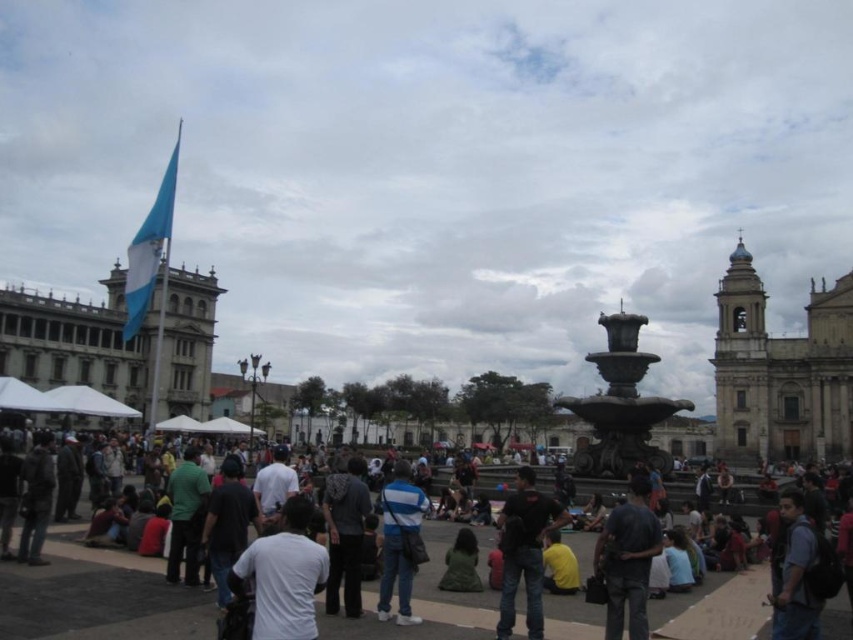
Looking at this image, between bronze ornate fountain at center and dark blue shirt at center, which one has more height?

bronze ornate fountain at center

Is bronze ornate fountain at center below dark blue shirt at center?

No.

Does point (596, 412) come closer to viewer compared to point (643, 637)?

No, it is not.

You are a GUI agent. You are given a task and a screenshot of the screen. Output one action in this format:
    pyautogui.click(x=<x>, y=<y>)
    Task: Click on the bronze ornate fountain at center
    
    Given the screenshot: What is the action you would take?
    pyautogui.click(x=619, y=404)

Is point (514, 596) closer to camera compared to point (390, 547)?

That is True.

Is black matte shirt at center to the left of striped cotton shirt at center from the viewer's perspective?

In fact, black matte shirt at center is to the right of striped cotton shirt at center.

The width and height of the screenshot is (853, 640). Describe the element at coordinates (524, 550) in the screenshot. I see `black matte shirt at center` at that location.

The image size is (853, 640). I want to click on black matte shirt at center, so [x=524, y=550].

Who is more forward, (399, 531) or (813, 561)?

Point (813, 561) is in front.

Is striped cotton shirt at center taller than blue denim jeans at lower right?

Correct, striped cotton shirt at center is much taller as blue denim jeans at lower right.

Which is behind, point (422, 493) or point (788, 576)?

Positioned behind is point (422, 493).

Where is `striped cotton shirt at center`? Image resolution: width=853 pixels, height=640 pixels. striped cotton shirt at center is located at coordinates (399, 541).